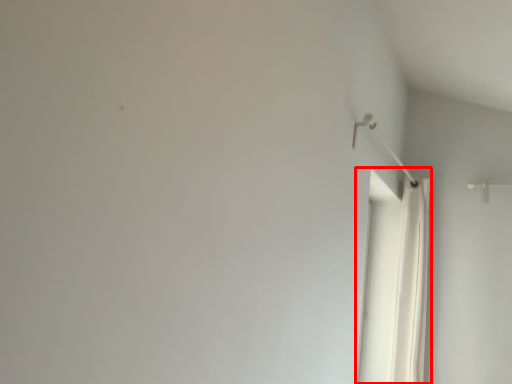
Question: From the image's perspective, considering the relative positions of shower curtain (annotated by the red box) and shower in the image provided, where is shower curtain (annotated by the red box) located with respect to the staircase?

Choices:
 (A) above
 (B) below

Answer: (B)